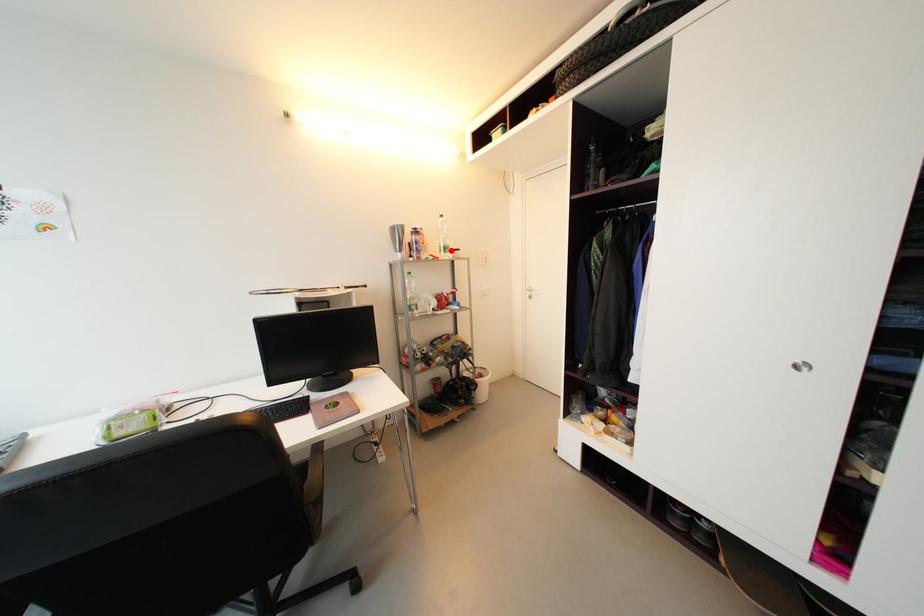
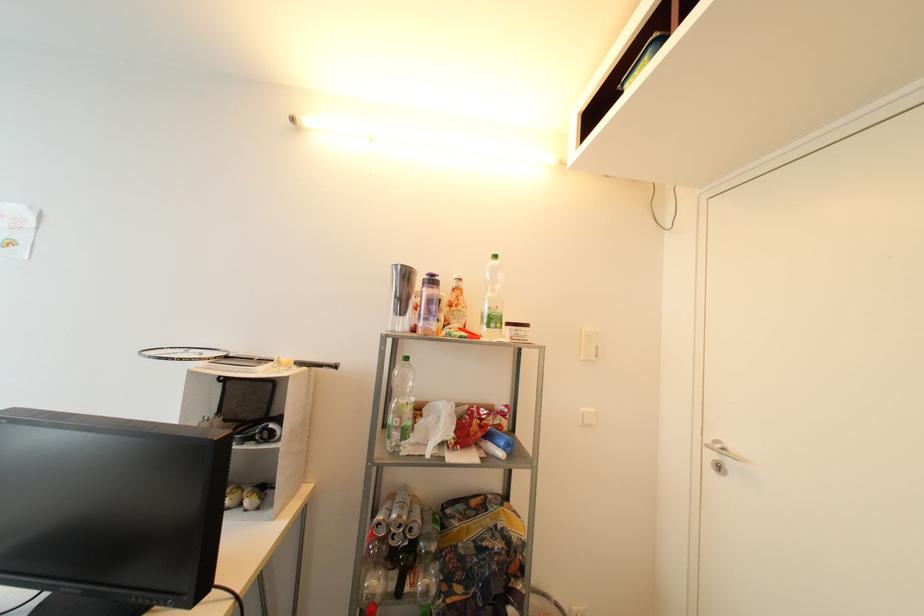
Where in the second image is the point corresponding to the highlighted location from the first image?

(499, 322)